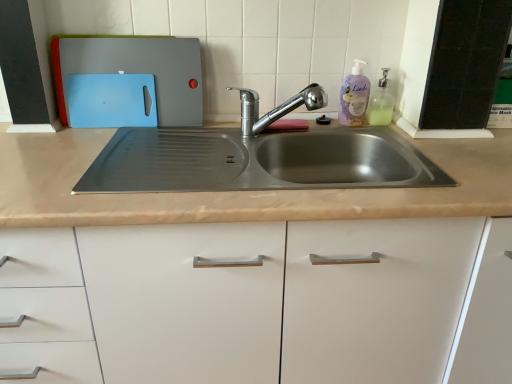
The height and width of the screenshot is (384, 512). What do you see at coordinates (134, 67) in the screenshot? I see `matte plastic cutting boards at upper left` at bounding box center [134, 67].

Find the location of `matte plastic cutting boards at upper left`. matte plastic cutting boards at upper left is located at coordinates (134, 67).

What is the approximate width of translucent plastic soap dispenser at upper right?

translucent plastic soap dispenser at upper right is 3.82 inches in width.

Locate an element on the screen. The image size is (512, 384). chrome metallic faucet at center is located at coordinates (276, 107).

Find the location of `soap dispenser that appears behind the matte plastic cutting boards at upper left`. soap dispenser that appears behind the matte plastic cutting boards at upper left is located at coordinates (x=381, y=103).

Considering the relative positions of translucent plastic soap dispenser at upper right and matte plastic cutting boards at upper left in the image provided, is translucent plastic soap dispenser at upper right behind matte plastic cutting boards at upper left?

Yes, translucent plastic soap dispenser at upper right is behind matte plastic cutting boards at upper left.

Considering the relative sizes of translucent plastic soap dispenser at upper right and matte plastic cutting boards at upper left in the image provided, is translucent plastic soap dispenser at upper right bigger than matte plastic cutting boards at upper left?

No, translucent plastic soap dispenser at upper right is not bigger than matte plastic cutting boards at upper left.

Is translucent plastic soap dispenser at upper right wider or thinner than matte plastic cutting boards at upper left?

In the image, translucent plastic soap dispenser at upper right appears to be wider than matte plastic cutting boards at upper left.

From the image's perspective, which one is positioned higher, translucent plastic soap dispenser at upper right or purple matte bottle at upper right?

From the image's view, purple matte bottle at upper right is above.

Does translucent plastic soap dispenser at upper right have a lesser width compared to purple matte bottle at upper right?

No.

Consider the image. From a real-world perspective, is translucent plastic soap dispenser at upper right under purple matte bottle at upper right?

Indeed, from a real-world perspective, translucent plastic soap dispenser at upper right is positioned beneath purple matte bottle at upper right.

From the image's perspective, between purple matte bottle at upper right and translucent plastic soap dispenser at upper right, who is located below?

translucent plastic soap dispenser at upper right appears lower in the image.

Who is more distant, purple matte bottle at upper right or translucent plastic soap dispenser at upper right?

translucent plastic soap dispenser at upper right.

Is purple matte bottle at upper right directly adjacent to translucent plastic soap dispenser at upper right?

Yes, purple matte bottle at upper right is next to translucent plastic soap dispenser at upper right.

Does purple matte bottle at upper right contain translucent plastic soap dispenser at upper right?

No.

Can you confirm if chrome metallic faucet at center is wider than purple matte bottle at upper right?

Yes.

Is point (247, 118) closer to camera compared to point (351, 97)?

Yes, point (247, 118) is closer to viewer.

Between chrome metallic faucet at center and purple matte bottle at upper right, which one has smaller size?

purple matte bottle at upper right is smaller.

Is purple matte bottle at upper right situated inside chrome metallic faucet at center or outside?

purple matte bottle at upper right cannot be found inside chrome metallic faucet at center.

Considering the positions of points (362, 61) and (243, 122), is point (362, 61) farther from camera compared to point (243, 122)?

Yes, it is behind point (243, 122).

At what (x,y) coordinates should I click in order to perform the action: click on tap on the left of purple matte bottle at upper right. Please return your answer as a coordinate pair (x, y). Looking at the image, I should click on (276, 107).

Is purple matte bottle at upper right wider or thinner than chrome metallic faucet at center?

In the image, purple matte bottle at upper right appears to be more narrow than chrome metallic faucet at center.

Does matte plastic cutting boards at upper left have a greater width compared to chrome metallic faucet at center?

No.

From the image's perspective, between matte plastic cutting boards at upper left and chrome metallic faucet at center, which one is located above?

matte plastic cutting boards at upper left.

Would you say matte plastic cutting boards at upper left is inside or outside chrome metallic faucet at center?

The correct answer is: outside.

Who is bigger, matte plastic cutting boards at upper left or chrome metallic faucet at center?

With larger size is matte plastic cutting boards at upper left.

Which of these two, chrome metallic faucet at center or translucent plastic soap dispenser at upper right, is smaller?

translucent plastic soap dispenser at upper right is smaller.

Between chrome metallic faucet at center and translucent plastic soap dispenser at upper right, which one appears on the right side from the viewer's perspective?

translucent plastic soap dispenser at upper right is more to the right.

Between chrome metallic faucet at center and translucent plastic soap dispenser at upper right, which one has larger width?

chrome metallic faucet at center.

Can you confirm if chrome metallic faucet at center is shorter than translucent plastic soap dispenser at upper right?

Indeed, chrome metallic faucet at center has a lesser height compared to translucent plastic soap dispenser at upper right.

The width and height of the screenshot is (512, 384). I want to click on appliance above the translucent plastic soap dispenser at upper right (from the image's perspective), so click(134, 67).

The height and width of the screenshot is (384, 512). I want to click on cleaning product above the translucent plastic soap dispenser at upper right (from a real-world perspective), so click(354, 96).

Based on their spatial positions, is matte plastic cutting boards at upper left or purple matte bottle at upper right further from chrome metallic faucet at center?

matte plastic cutting boards at upper left.

Estimate the real-world distances between objects in this image. Which object is further from matte plastic cutting boards at upper left, purple matte bottle at upper right or translucent plastic soap dispenser at upper right?

Among the two, translucent plastic soap dispenser at upper right is located further to matte plastic cutting boards at upper left.

From the image, which object appears to be nearer to chrome metallic faucet at center, translucent plastic soap dispenser at upper right or matte plastic cutting boards at upper left?

Based on the image, matte plastic cutting boards at upper left appears to be nearer to chrome metallic faucet at center.

Based on their spatial positions, is chrome metallic faucet at center or matte plastic cutting boards at upper left closer to translucent plastic soap dispenser at upper right?

The object closer to translucent plastic soap dispenser at upper right is chrome metallic faucet at center.

Considering their positions, is chrome metallic faucet at center positioned further to purple matte bottle at upper right than matte plastic cutting boards at upper left?

The object further to purple matte bottle at upper right is matte plastic cutting boards at upper left.

When comparing their distances from purple matte bottle at upper right, does translucent plastic soap dispenser at upper right or chrome metallic faucet at center seem further?

chrome metallic faucet at center.

When comparing their distances from purple matte bottle at upper right, does chrome metallic faucet at center or translucent plastic soap dispenser at upper right seem further?

Among the two, chrome metallic faucet at center is located further to purple matte bottle at upper right.

Looking at the image, which one is located closer to matte plastic cutting boards at upper left, purple matte bottle at upper right or chrome metallic faucet at center?

chrome metallic faucet at center lies closer to matte plastic cutting boards at upper left than the other object.

Identify the location of cleaning product between matte plastic cutting boards at upper left and translucent plastic soap dispenser at upper right in the horizontal direction. (354, 96).

Identify the location of tap located between matte plastic cutting boards at upper left and purple matte bottle at upper right in the left-right direction. The width and height of the screenshot is (512, 384). (276, 107).

Where is `tap between matte plastic cutting boards at upper left and translucent plastic soap dispenser at upper right`? tap between matte plastic cutting boards at upper left and translucent plastic soap dispenser at upper right is located at coordinates (276, 107).

This screenshot has height=384, width=512. Identify the location of cleaning product located between chrome metallic faucet at center and translucent plastic soap dispenser at upper right in the left-right direction. (354, 96).